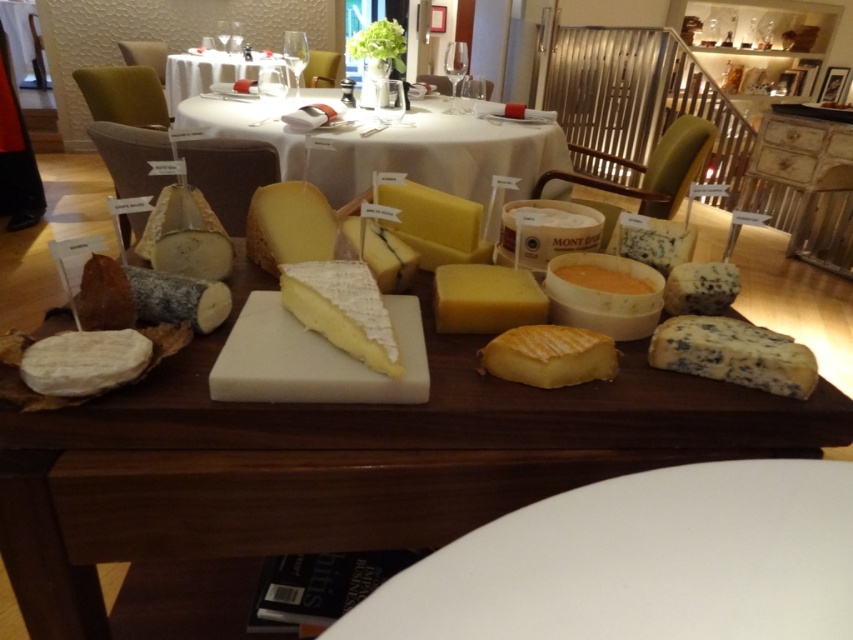
Does white glossy plate at lower center have a smaller size compared to wooden cheese board at center?

Indeed, white glossy plate at lower center has a smaller size compared to wooden cheese board at center.

Who is taller, white glossy plate at lower center or wooden cheese board at center?

wooden cheese board at center

Is point (434, 621) farther from camera compared to point (47, 228)?

No, it is in front of (47, 228).

The width and height of the screenshot is (853, 640). I want to click on white glossy plate at lower center, so click(641, 563).

Does white glossy plate at lower center have a lesser width compared to white porcelain table at upper center?

Correct, white glossy plate at lower center's width is less than white porcelain table at upper center's.

Who is higher up, white glossy plate at lower center or white porcelain table at upper center?

white porcelain table at upper center is higher up.

Is point (767, 474) farther from viewer compared to point (173, 60)?

No, it is not.

At what (x,y) coordinates should I click in order to perform the action: click on white glossy plate at lower center. Please return your answer as a coordinate pair (x, y). Looking at the image, I should click on (641, 563).

Which is behind, point (561, 161) or point (442, 209)?

The point (561, 161) is more distant.

Which is more to the right, white marble cheese board at center or yellow hard cheese at center?

yellow hard cheese at center

Identify the location of white marble cheese board at center. (439, 154).